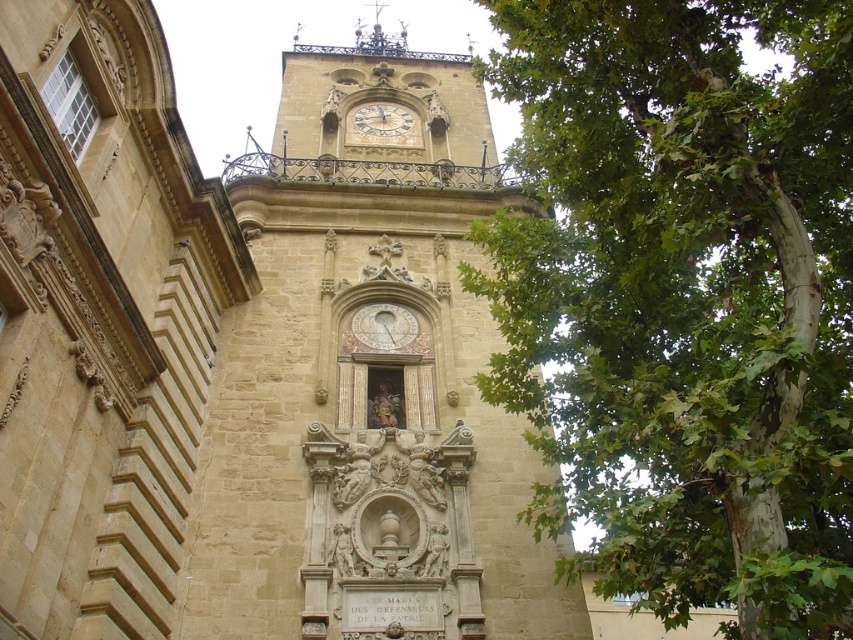
Question: Can you confirm if stone clock tower at center is positioned above gold-toned metal clock at upper center?

Choices:
 (A) yes
 (B) no

Answer: (B)

Question: Which object appears farthest from the camera in this image?

Choices:
 (A) green leafy tree at upper right
 (B) gold metallic clock at center
 (C) gold-toned metal clock at upper center

Answer: (C)

Question: Which point appears farthest from the camera in this image?

Choices:
 (A) (402, 116)
 (B) (415, 321)
 (C) (408, 454)
 (D) (525, 248)

Answer: (A)

Question: Does gold metallic clock at center have a smaller size compared to gold-toned metal clock at upper center?

Choices:
 (A) no
 (B) yes

Answer: (B)

Question: Is gold metallic clock at center above gold-toned metal clock at upper center?

Choices:
 (A) no
 (B) yes

Answer: (A)

Question: Which object is closer to the camera taking this photo?

Choices:
 (A) stone clock tower at center
 (B) green leafy tree at upper right
 (C) gold metallic clock at center
 (D) gold-toned metal clock at upper center

Answer: (B)